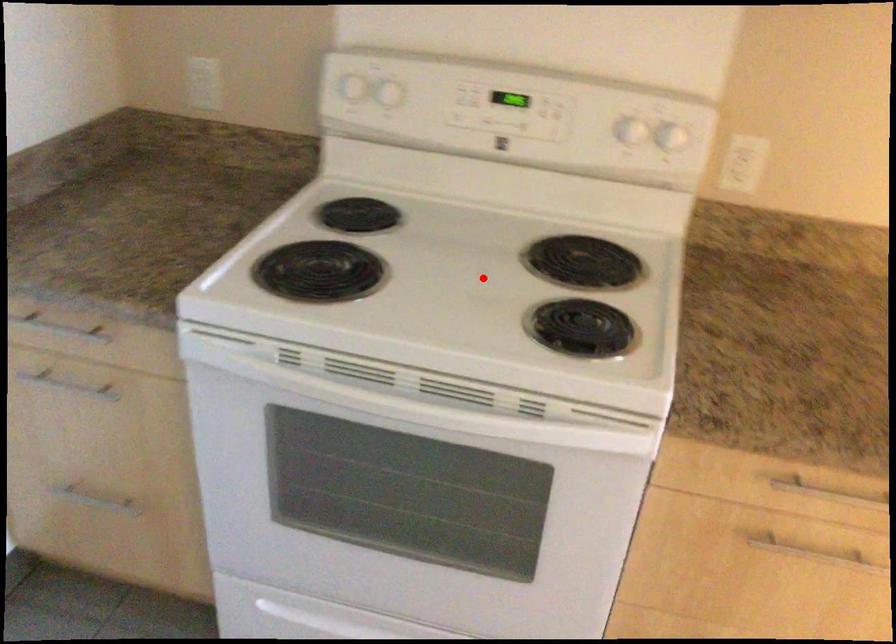
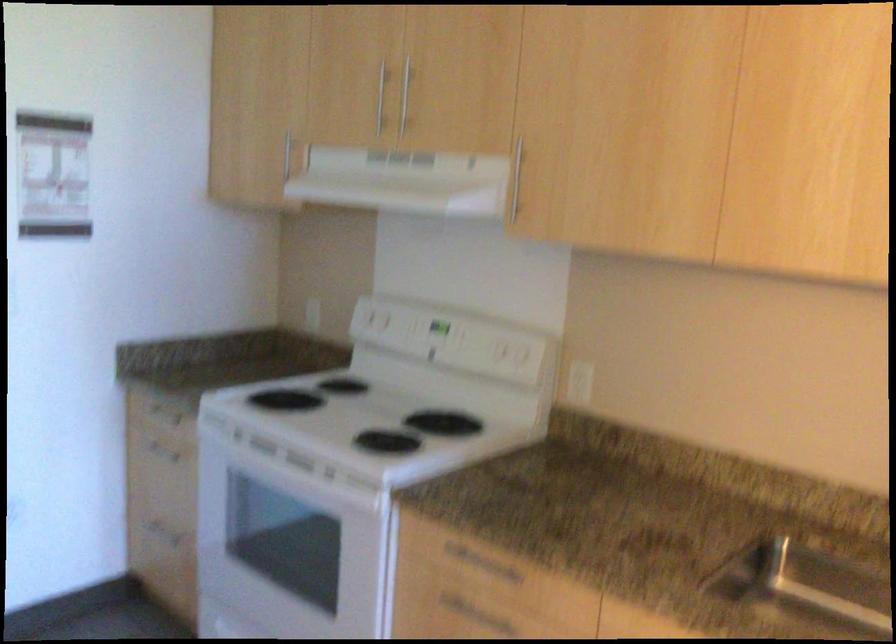
Question: I am providing you with two images of the same scene from different viewpoints. In image1, a red point is highlighted. Considering the same 3D point in image2, which of the following is correct?

Choices:
 (A) It is closer
 (B) It is farther

Answer: (B)